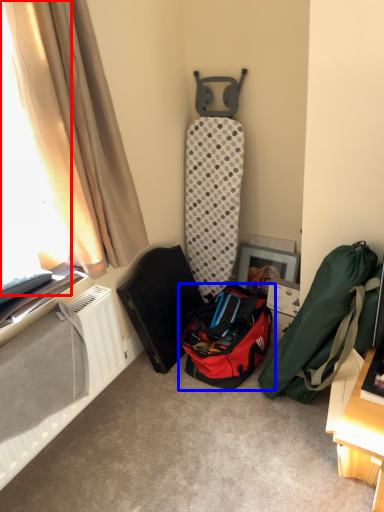
Question: Which object is closer to the camera taking this photo, window screen (highlighted by a red box) or luggage and bags (highlighted by a blue box)?

Choices:
 (A) window screen
 (B) luggage and bags

Answer: (A)